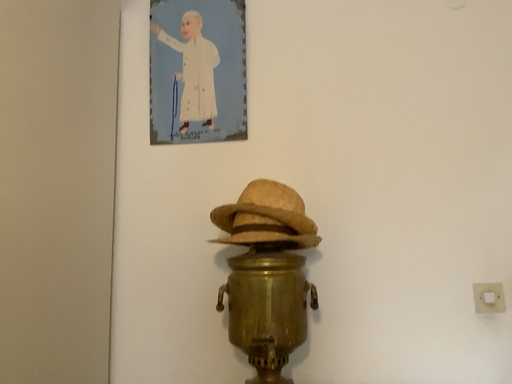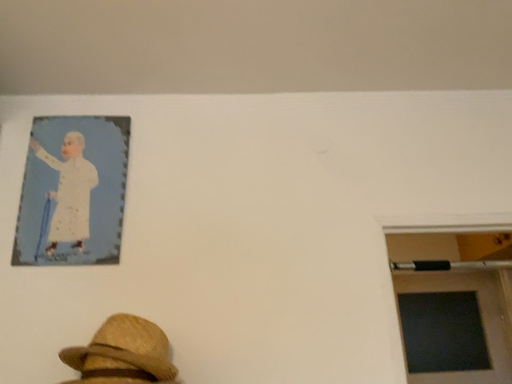
Question: How did the camera likely rotate when shooting the video?

Choices:
 (A) rotated right
 (B) rotated left

Answer: (A)